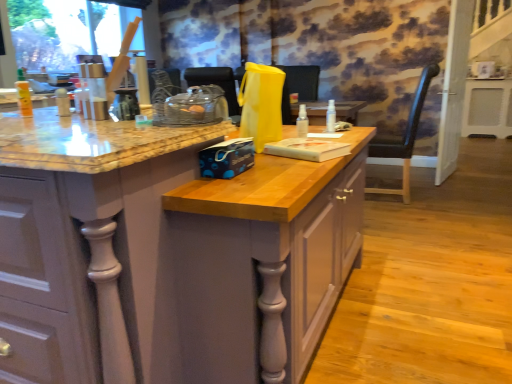
Question: Can we say transparent plastic spray bottle at center, the 2th bottle when ordered from right to left, lies outside matte wood cabinet at center?

Choices:
 (A) yes
 (B) no

Answer: (B)

Question: Does transparent plastic spray bottle at center, the first bottle when ordered from front to back, have a lesser width compared to matte wood cabinet at center?

Choices:
 (A) no
 (B) yes

Answer: (B)

Question: Can you see transparent plastic spray bottle at center, which is counted as the 1th bottle, starting from the left, touching matte wood cabinet at center?

Choices:
 (A) no
 (B) yes

Answer: (A)

Question: Does transparent plastic spray bottle at center, the first bottle when ordered from front to back, have a lesser height compared to matte wood cabinet at center?

Choices:
 (A) yes
 (B) no

Answer: (A)

Question: Is the position of transparent plastic spray bottle at center, the 2th bottle when ordered from right to left, more distant than that of matte wood cabinet at center?

Choices:
 (A) yes
 (B) no

Answer: (A)

Question: From the image's perspective, is transparent plastic spray bottle at center, which is counted as the 1th bottle, starting from the left, on top of matte wood cabinet at center?

Choices:
 (A) yes
 (B) no

Answer: (A)

Question: Is transparent plastic spray bottle at center, which is the second bottle from back to front, not inside white plastic heater at right?

Choices:
 (A) no
 (B) yes

Answer: (B)

Question: From a real-world perspective, is transparent plastic spray bottle at center, which is counted as the 1th bottle, starting from the left, physically below white plastic heater at right?

Choices:
 (A) yes
 (B) no

Answer: (B)

Question: Can you confirm if transparent plastic spray bottle at center, which is counted as the 1th bottle, starting from the left, is shorter than white plastic heater at right?

Choices:
 (A) no
 (B) yes

Answer: (B)

Question: Can you confirm if transparent plastic spray bottle at center, the 2th bottle when ordered from right to left, is thinner than white plastic heater at right?

Choices:
 (A) no
 (B) yes

Answer: (B)

Question: Is transparent plastic spray bottle at center, which is counted as the 1th bottle, starting from the left, to the right of white plastic heater at right from the viewer's perspective?

Choices:
 (A) no
 (B) yes

Answer: (A)

Question: Is transparent plastic spray bottle at center, the first bottle when ordered from front to back, surrounding white plastic heater at right?

Choices:
 (A) yes
 (B) no

Answer: (B)

Question: Is white glossy screen door at right shorter than black leather chair at right?

Choices:
 (A) yes
 (B) no

Answer: (B)